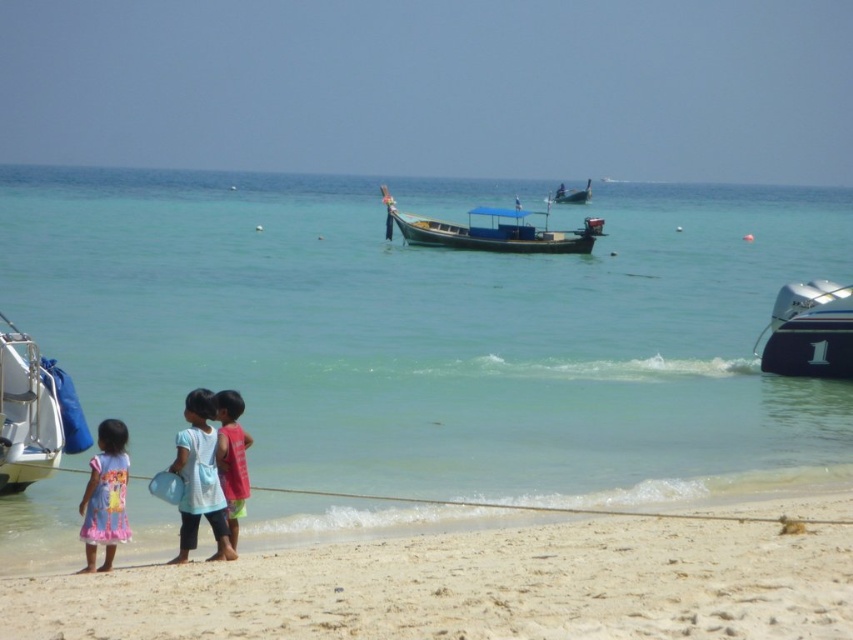
You are standing on the beach and want to walk from the point marked at coordinates point (830, 298) to the point marked at coordinates point (584, 195). Which direction should you face to walk directly towards your destination?

Since point (830, 298) is in front of point (584, 195), you should face north to walk directly towards your destination.

You are a photographer on the beach and want to capture both the white glossy motorboat at right and the wooden longboat at center in the same frame. Which boat should you position closer to the left side of your camera viewfinder to include both?

The white glossy motorboat at right is positioned on the left side of wooden longboat at center, so you should position the white glossy motorboat at right closer to the left side of your camera viewfinder to include both boats in the frame.

You are a photographer positioned at the center of the beach scene. You want to capture a shot that includes the printed cotton dress at lower left. Which direction should you aim your camera to include it in the frame?

The printed cotton dress at lower left is located at point [105,496], which is to the left side of the scene. Aim your camera to the left to include the printed cotton dress at lower left in the frame.